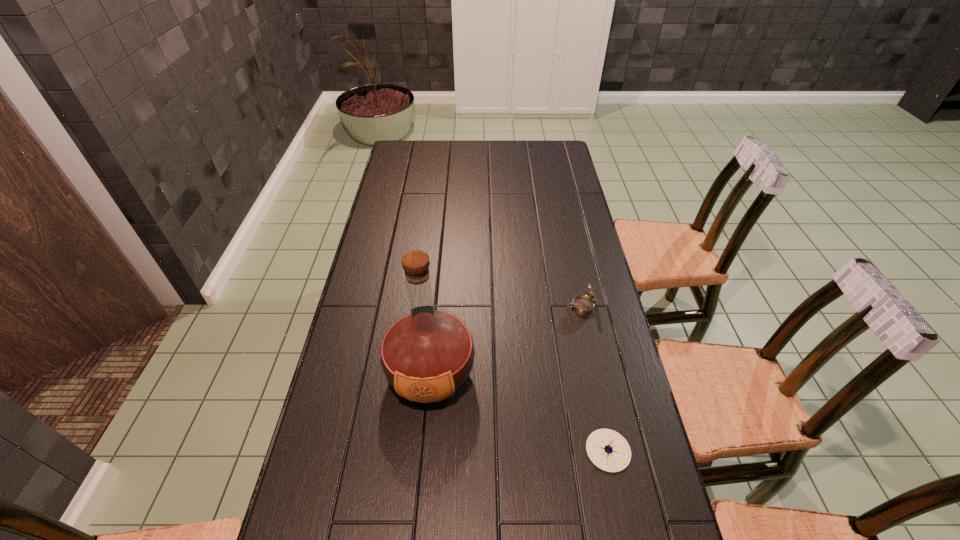
Locate an element on the screen. This screenshot has height=540, width=960. liquor is located at coordinates (427, 354).

The image size is (960, 540). I want to click on the leftmost object, so click(427, 354).

Image resolution: width=960 pixels, height=540 pixels. What are the coordinates of `the farthest object` in the screenshot? It's located at (582, 304).

Locate an element on the screen. The image size is (960, 540). the taller compass is located at coordinates (x=582, y=304).

This screenshot has height=540, width=960. Find the location of `the shortest object`. the shortest object is located at coordinates (608, 450).

Where is `the nearer compass`? This screenshot has height=540, width=960. the nearer compass is located at coordinates (608, 450).

Identify the location of vacant space positioned on the front label of the liquor. The image size is (960, 540). (418, 517).

Locate an element on the screen. The image size is (960, 540). vacant space located with the dial facing the second shortest object is located at coordinates (473, 307).

Where is `blank space located 0.340m with the dial facing the second shortest object`? This screenshot has width=960, height=540. blank space located 0.340m with the dial facing the second shortest object is located at coordinates (457, 307).

This screenshot has height=540, width=960. I want to click on vacant space positioned 0.060m with the dial facing the second shortest object, so click(x=548, y=307).